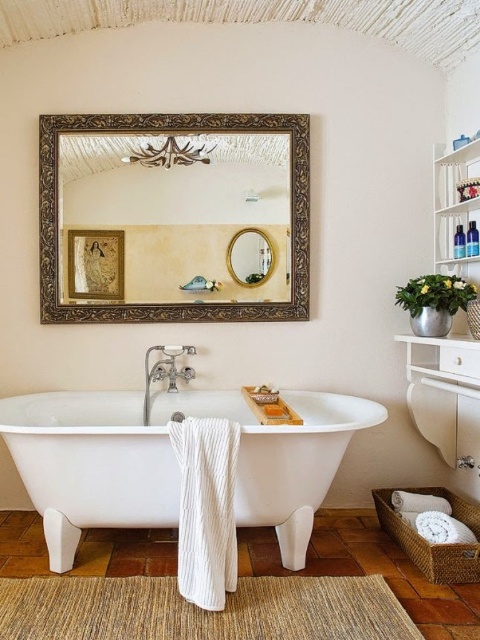
You are a home decorator planning to install a new light fixture between the gold ornate mirror at upper center and the white glossy bathtub at center. The fixture requires a minimum of 30 inches of space between the two objects to be safely installed. Based on the scene, can you confirm if there is enough space for the installation?

The gold ornate mirror at upper center is 34.03 inches away from the white glossy bathtub at center, which is more than the required 30 inches. Therefore, there is sufficient space to install the light fixture between them safely.

You are standing in the bathroom and want to reach the gold ornate mirror at upper center to clean it. If your arm can extend 3 feet, can you reach it without a ladder?

The gold ornate mirror at upper center is 9.31 feet away from the viewer. Since your arm can only extend 3 feet, you cannot reach it without a ladder.

You are standing at the entrance of the bathroom and want to reach the white glossy bathtub at center. Based on its coordinates, in which direction should you move from the entrance?

The white glossy bathtub at center is located at coordinates point [172,460]. Since bathrooms are typically entered from the front, which would be the lower part of the image, you should move forward towards the center of the room to reach it.